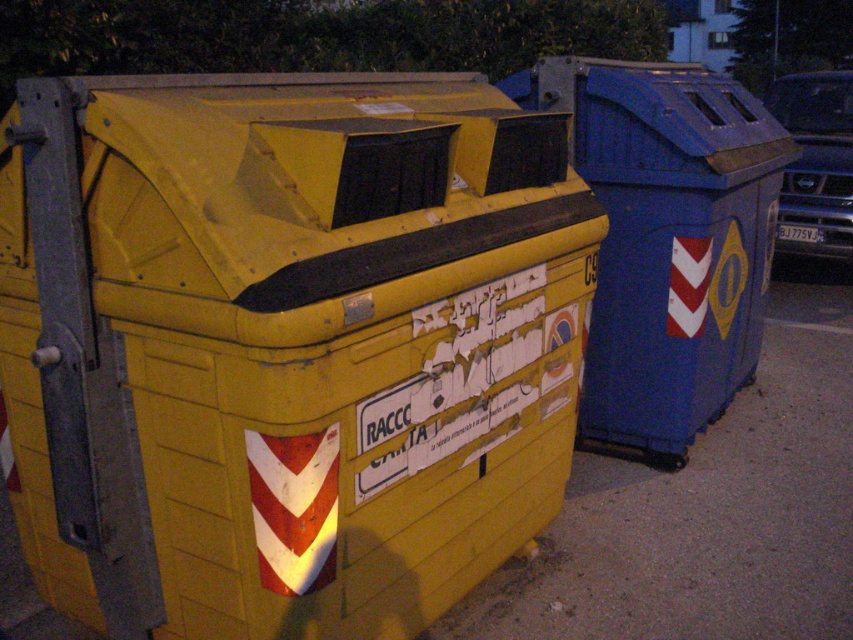
You are standing at the origin point in the image. Which object is located at point (283, 344)?

The yellow matte plastic recycling bin at left is located at point (283, 344).

You are standing in front of the yellow matte plastic recycling bin at left and the blue plastic recycling bin at right. Which one is positioned lower in the image?

The yellow matte plastic recycling bin at left is positioned below the blue plastic recycling bin at right, so it is lower in the image.

You are standing in front of the two containers and want to know which point is closer to you. The points are labeled as point 1 at coordinates (241,396) and point 2 at coordinates (660,211). Which point is closer to your current position?

Point 1 at coordinates (241,396) is closer to your current position than point 2 at coordinates (660,211).